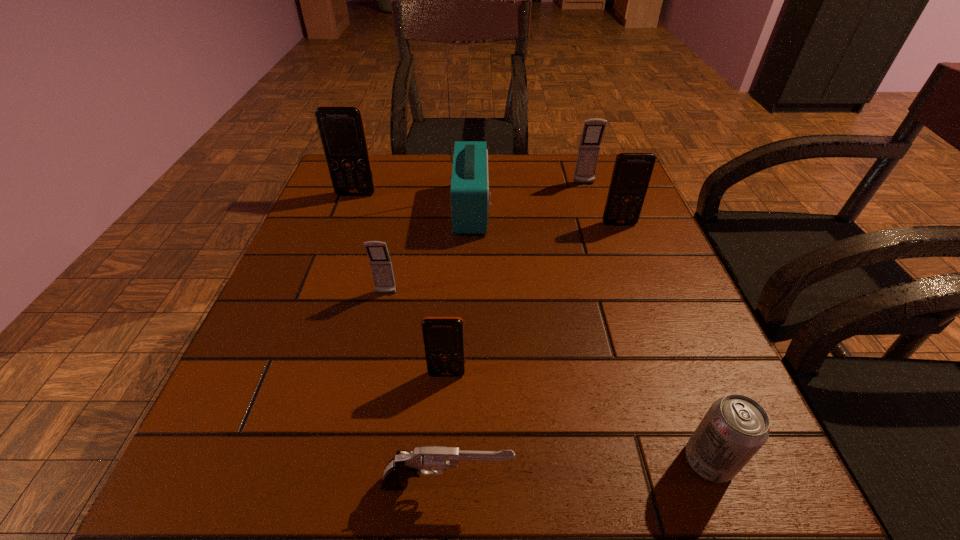
Find the location of a particular element. radio receiver is located at coordinates (470, 203).

Find the location of a particular element. Image resolution: width=960 pixels, height=540 pixels. the tallest object is located at coordinates (470, 203).

The width and height of the screenshot is (960, 540). I want to click on the leftmost orange cellular telephone, so click(x=341, y=128).

Identify the location of the second farthest cellular telephone. (341, 128).

Locate an element on the screen. the farthest cellular telephone is located at coordinates (593, 130).

Where is `the bigger gray cellular telephone`? the bigger gray cellular telephone is located at coordinates (593, 130).

Find the location of a particular element. The width and height of the screenshot is (960, 540). the second biggest orange cellular telephone is located at coordinates (632, 171).

Locate an element on the screen. This screenshot has height=540, width=960. the third farthest cellular telephone is located at coordinates (632, 171).

Find the location of `the third cellular telephone from left to right`. the third cellular telephone from left to right is located at coordinates (443, 337).

You are a GUI agent. You are given a task and a screenshot of the screen. Output one action in this format:
    pyautogui.click(x=<x>, y=<y>)
    Task: Click on the nearest orange cellular telephone
    
    Given the screenshot: What is the action you would take?
    pyautogui.click(x=443, y=337)